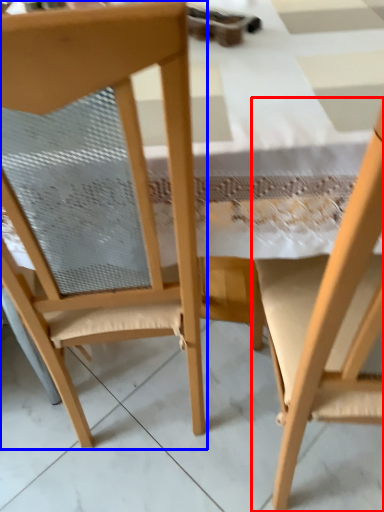
Question: Among these objects, which one is nearest to the camera, chair (highlighted by a red box) or chair (highlighted by a blue box)?

Choices:
 (A) chair
 (B) chair

Answer: (A)